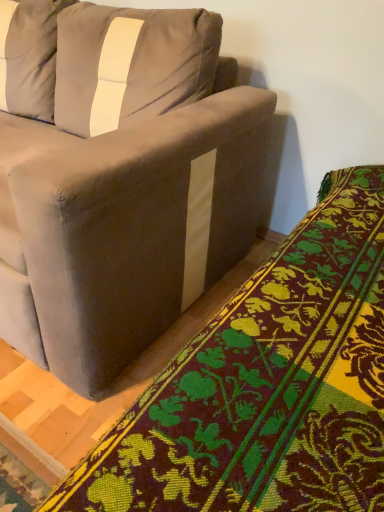
The width and height of the screenshot is (384, 512). What do you see at coordinates (267, 385) in the screenshot? I see `velvet-like green and yellow floral blanket at lower right` at bounding box center [267, 385].

Identify the location of velvet-like green and yellow floral blanket at lower right. The width and height of the screenshot is (384, 512). (267, 385).

Image resolution: width=384 pixels, height=512 pixels. Identify the location of suede-like gray couch at upper left. (118, 179).

This screenshot has width=384, height=512. Describe the element at coordinates (118, 179) in the screenshot. I see `suede-like gray couch at upper left` at that location.

Where is `velvet-like green and yellow floral blanket at lower right`? velvet-like green and yellow floral blanket at lower right is located at coordinates (267, 385).

Can you confirm if suede-like gray couch at upper left is positioned to the left of velvet-like green and yellow floral blanket at lower right?

Yes.

Is the depth of suede-like gray couch at upper left greater than that of velvet-like green and yellow floral blanket at lower right?

Yes, suede-like gray couch at upper left is behind velvet-like green and yellow floral blanket at lower right.

Is point (172, 112) in front of point (178, 406)?

No, it is not.

From the image's perspective, is suede-like gray couch at upper left above or below velvet-like green and yellow floral blanket at lower right?

suede-like gray couch at upper left is above velvet-like green and yellow floral blanket at lower right.

From a real-world perspective, is suede-like gray couch at upper left below velvet-like green and yellow floral blanket at lower right?

Indeed, from a real-world perspective, suede-like gray couch at upper left is positioned beneath velvet-like green and yellow floral blanket at lower right.

Is suede-like gray couch at upper left thinner than velvet-like green and yellow floral blanket at lower right?

No.

In the scene shown: In terms of height, does suede-like gray couch at upper left look taller or shorter compared to velvet-like green and yellow floral blanket at lower right?

suede-like gray couch at upper left is taller than velvet-like green and yellow floral blanket at lower right.

Does suede-like gray couch at upper left have a smaller size compared to velvet-like green and yellow floral blanket at lower right?

No.

Do you think suede-like gray couch at upper left is within velvet-like green and yellow floral blanket at lower right, or outside of it?

suede-like gray couch at upper left exists outside the volume of velvet-like green and yellow floral blanket at lower right.

Is suede-like gray couch at upper left not near velvet-like green and yellow floral blanket at lower right?

Actually, suede-like gray couch at upper left and velvet-like green and yellow floral blanket at lower right are a little close together.

Is suede-like gray couch at upper left looking in the opposite direction of velvet-like green and yellow floral blanket at lower right?

No, suede-like gray couch at upper left is not facing away from velvet-like green and yellow floral blanket at lower right.

How far apart are suede-like gray couch at upper left and velvet-like green and yellow floral blanket at lower right?

They are 20.08 inches apart.

Identify the location of blanket that is below the suede-like gray couch at upper left (from the image's perspective). The height and width of the screenshot is (512, 384). (267, 385).

Visually, is velvet-like green and yellow floral blanket at lower right positioned to the left or to the right of suede-like gray couch at upper left?

Based on their positions, velvet-like green and yellow floral blanket at lower right is located to the right of suede-like gray couch at upper left.

Which is behind, velvet-like green and yellow floral blanket at lower right or suede-like gray couch at upper left?

suede-like gray couch at upper left is behind.

Is point (279, 263) positioned in front of point (106, 312)?

That is True.

From the image's perspective, does velvet-like green and yellow floral blanket at lower right appear higher than suede-like gray couch at upper left?

No.

From the picture: From a real-world perspective, is velvet-like green and yellow floral blanket at lower right physically above suede-like gray couch at upper left?

Indeed, from a real-world perspective, velvet-like green and yellow floral blanket at lower right stands above suede-like gray couch at upper left.

Which object is thinner, velvet-like green and yellow floral blanket at lower right or suede-like gray couch at upper left?

Thinner between the two is velvet-like green and yellow floral blanket at lower right.

Is velvet-like green and yellow floral blanket at lower right taller or shorter than suede-like gray couch at upper left?

Clearly, velvet-like green and yellow floral blanket at lower right is shorter compared to suede-like gray couch at upper left.

In terms of size, does velvet-like green and yellow floral blanket at lower right appear bigger or smaller than suede-like gray couch at upper left?

Clearly, velvet-like green and yellow floral blanket at lower right is smaller in size than suede-like gray couch at upper left.

Is velvet-like green and yellow floral blanket at lower right inside or outside of suede-like gray couch at upper left?

velvet-like green and yellow floral blanket at lower right is not enclosed by suede-like gray couch at upper left.

Is velvet-like green and yellow floral blanket at lower right positioned with its back to suede-like gray couch at upper left?

No, velvet-like green and yellow floral blanket at lower right's orientation is not away from suede-like gray couch at upper left.

Can you tell me how much velvet-like green and yellow floral blanket at lower right and suede-like gray couch at upper left differ in facing direction?

The angle between the facing direction of velvet-like green and yellow floral blanket at lower right and the facing direction of suede-like gray couch at upper left is 90 degrees.

Image resolution: width=384 pixels, height=512 pixels. In order to click on studio couch directly beneath the velvet-like green and yellow floral blanket at lower right (from a real-world perspective) in this screenshot , I will do [118, 179].

In order to click on studio couch that appears below the velvet-like green and yellow floral blanket at lower right (from a real-world perspective) in this screenshot , I will do [118, 179].

Locate an element on the screen. This screenshot has width=384, height=512. studio couch above the velvet-like green and yellow floral blanket at lower right (from the image's perspective) is located at coordinates pos(118,179).